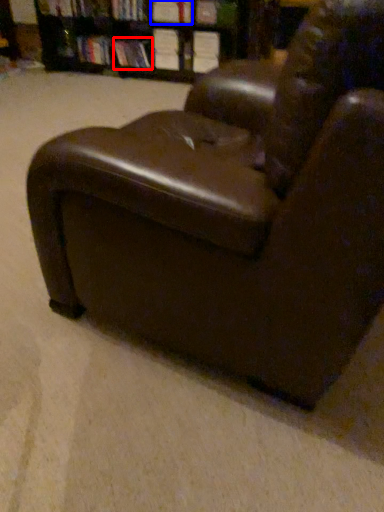
Question: Among these objects, which one is farthest to the camera, book (highlighted by a red box) or book (highlighted by a blue box)?

Choices:
 (A) book
 (B) book

Answer: (A)